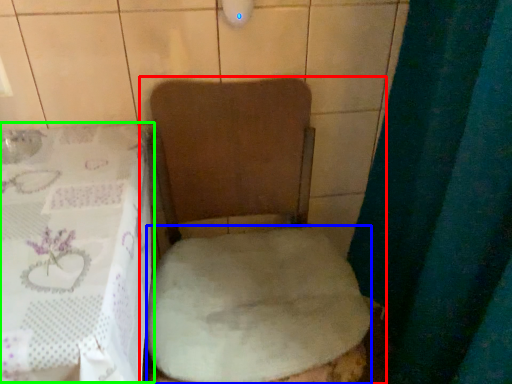
Question: Which object is the farthest from toilet (highlighted by a red box)? Choose among these: sheet (highlighted by a blue box) or table (highlighted by a green box).

Choices:
 (A) sheet
 (B) table

Answer: (B)